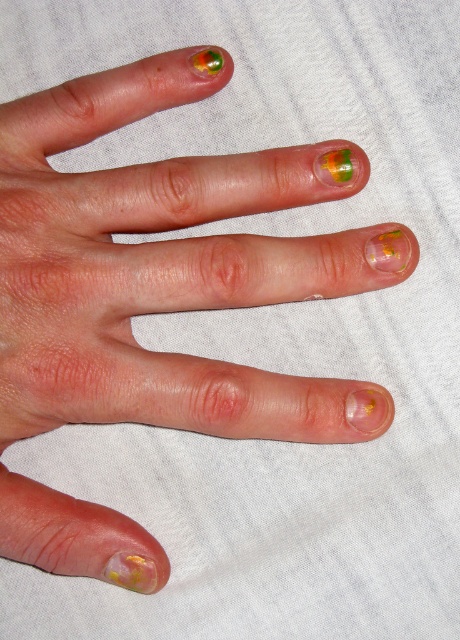
Based on the photo, is shiny yellow-green nail polish at lower left to the right of green matte nail polish at upper center from the viewer's perspective?

Incorrect, shiny yellow-green nail polish at lower left is not on the right side of green matte nail polish at upper center.

What do you see at coordinates (132, 572) in the screenshot? This screenshot has height=640, width=460. I see `shiny yellow-green nail polish at lower left` at bounding box center [132, 572].

Locate an element on the screen. Image resolution: width=460 pixels, height=640 pixels. shiny yellow-green nail polish at lower left is located at coordinates (132, 572).